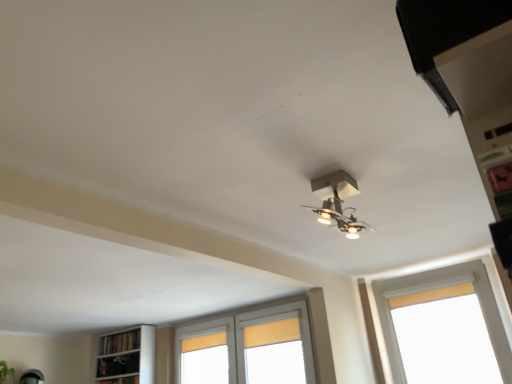
Question: From a real-world perspective, is metallic silver light fixture at center above or below wooden bookshelf at lower left?

Choices:
 (A) below
 (B) above

Answer: (B)

Question: From the image's perspective, is metallic silver light fixture at center located above or below wooden bookshelf at lower left?

Choices:
 (A) below
 (B) above

Answer: (B)

Question: Which is nearer to the white painted wood window at right, which is the first window in front-to-back order?

Choices:
 (A) wooden bookshelf at lower left
 (B) metallic silver light fixture at center
 (C) white wooden window at center, the second window viewed from the front
 (D) black matte exhaust hood at upper right

Answer: (C)

Question: Based on their relative distances, which object is nearer to the metallic silver light fixture at center?

Choices:
 (A) black matte exhaust hood at upper right
 (B) white painted wood window at right, the 2th window in the left-to-right sequence
 (C) wooden bookshelf at lower left
 (D) white wooden window at center, which is the 1th window in back-to-front order

Answer: (A)